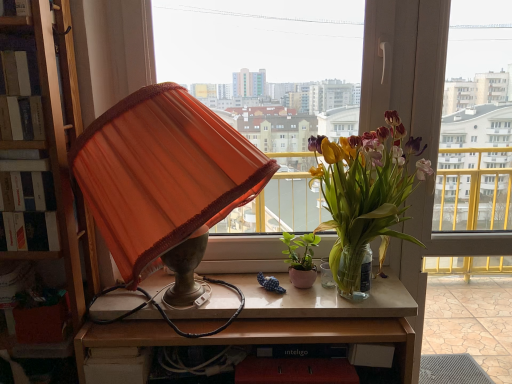
Where is `free location in front of green matte plant at center, acting as the 1th houseplant starting from the left`? The height and width of the screenshot is (384, 512). free location in front of green matte plant at center, acting as the 1th houseplant starting from the left is located at coordinates (309, 300).